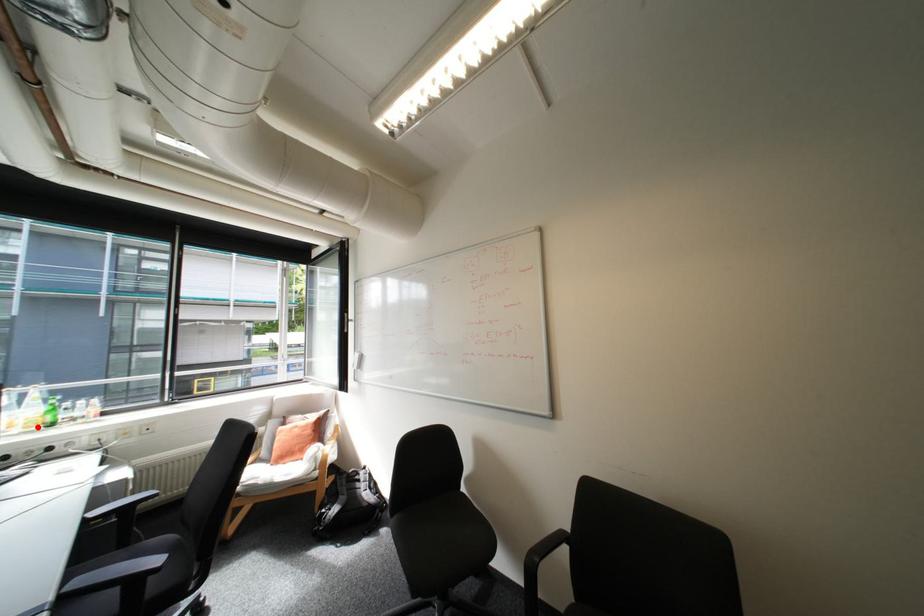
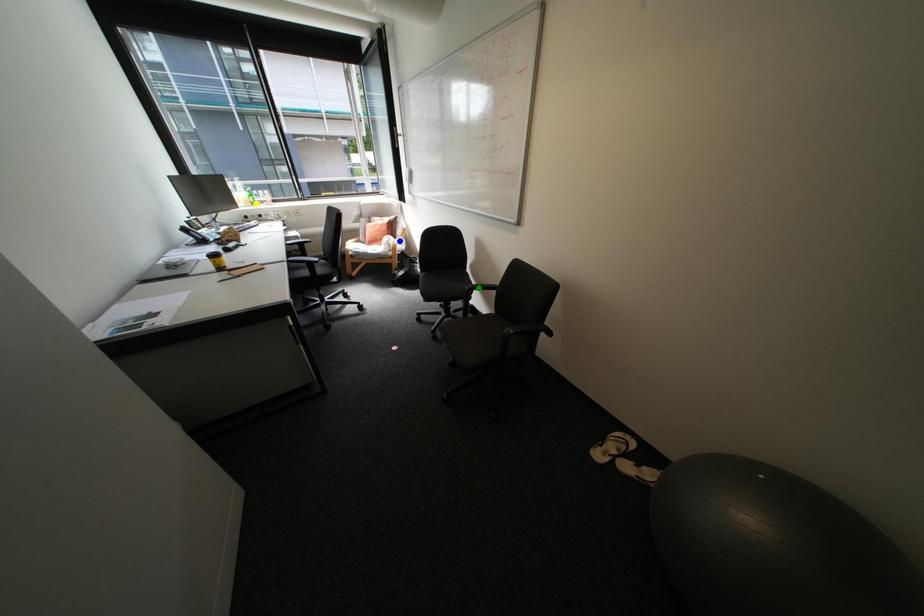
Question: I am providing you with two images of the same scene from different viewpoints. A red point is marked on the first image. You are given multiple points on the second image. Which point in image 2 is actually the same real-world point as the red point in image 1?

Choices:
 (A) blue point
 (B) green point
 (C) yellow point

Answer: (C)